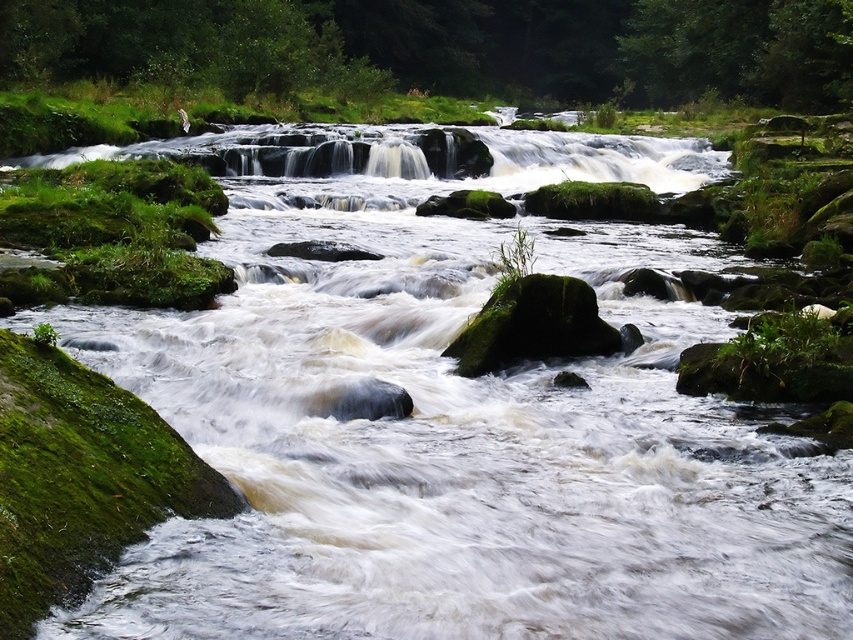
Can you confirm if green mossy rocks at center is positioned below green mossy rock at center?

No.

Who is lower down, green mossy rocks at center or green mossy rock at center?

green mossy rock at center is below.

Which is behind, point (675, 29) or point (576, 300)?

Positioned behind is point (675, 29).

This screenshot has width=853, height=640. Find the location of `green mossy rocks at center`. green mossy rocks at center is located at coordinates (457, 44).